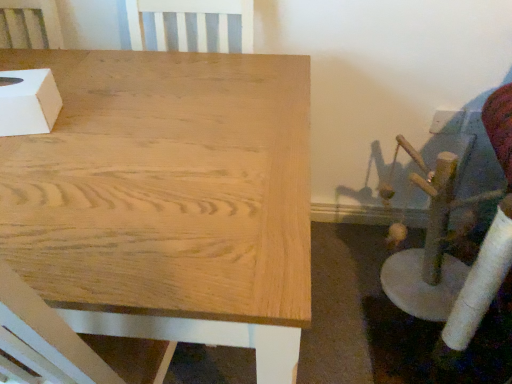
Locate an element on the screen. The height and width of the screenshot is (384, 512). vacant space behind white matte tissue box at upper left is located at coordinates (72, 71).